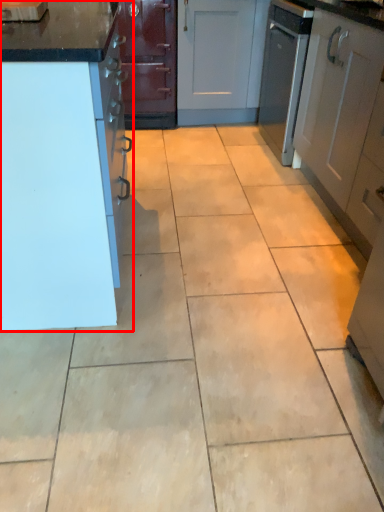
Question: Observing the image, what is the correct spatial positioning of cabinetry (annotated by the red box) in reference to cabinetry?

Choices:
 (A) right
 (B) left

Answer: (B)